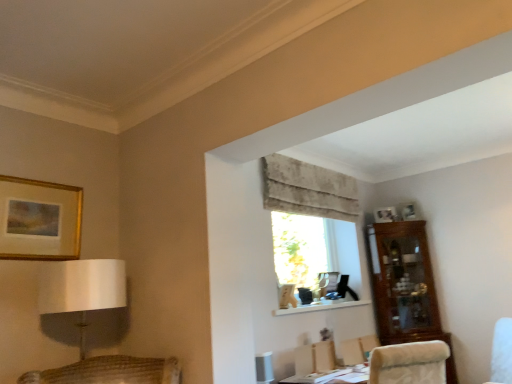
Question: Is gold/glossy picture frame at upper left, marked as the 1th picture frame in a left-to-right arrangement, closer to the viewer compared to beige textured curtain at upper center?

Choices:
 (A) yes
 (B) no

Answer: (A)

Question: Is gold/glossy picture frame at upper left, marked as the 1th picture frame in a left-to-right arrangement, oriented towards beige textured curtain at upper center?

Choices:
 (A) no
 (B) yes

Answer: (A)

Question: Is gold/glossy picture frame at upper left, which is the 3th picture frame from back to front, wider than beige textured curtain at upper center?

Choices:
 (A) no
 (B) yes

Answer: (A)

Question: From the image's perspective, would you say gold/glossy picture frame at upper left, which is the third picture frame from right to left, is shown under beige textured curtain at upper center?

Choices:
 (A) yes
 (B) no

Answer: (A)

Question: From the image's perspective, is gold/glossy picture frame at upper left, which is the third picture frame from right to left, located above beige textured curtain at upper center?

Choices:
 (A) no
 (B) yes

Answer: (A)

Question: Looking at the image, does white matte shelf at center seem bigger or smaller compared to white glossy picture frame at upper right, positioned as the third picture frame in front-to-back order?

Choices:
 (A) big
 (B) small

Answer: (A)

Question: Which is correct: white matte shelf at center is inside white glossy picture frame at upper right, arranged as the third picture frame when viewed from the left, or outside of it?

Choices:
 (A) inside
 (B) outside

Answer: (B)

Question: From the image's perspective, relative to white glossy picture frame at upper right, positioned as the third picture frame in front-to-back order, is white matte shelf at center above or below?

Choices:
 (A) above
 (B) below

Answer: (B)

Question: Considering the positions of point (307, 309) and point (399, 206), is point (307, 309) closer or farther from the camera than point (399, 206)?

Choices:
 (A) closer
 (B) farther

Answer: (A)

Question: Is point coord(316,220) closer or farther from the camera than point coord(51,195)?

Choices:
 (A) farther
 (B) closer

Answer: (A)

Question: Is translucent fabric window at center to the left or to the right of gold/glossy picture frame at upper left, marked as the 1th picture frame in a left-to-right arrangement, in the image?

Choices:
 (A) right
 (B) left

Answer: (A)

Question: From the image's perspective, is translucent fabric window at center positioned above or below gold/glossy picture frame at upper left, marked as the 1th picture frame in a left-to-right arrangement?

Choices:
 (A) above
 (B) below

Answer: (B)

Question: Is translucent fabric window at center bigger or smaller than gold/glossy picture frame at upper left, marked as the 1th picture frame in a left-to-right arrangement?

Choices:
 (A) small
 (B) big

Answer: (B)

Question: Considering their positions, is beige textured curtain at upper center located in front of or behind matte silver picture frame at upper right, marked as the 2th picture frame in a right-to-left arrangement?

Choices:
 (A) behind
 (B) front

Answer: (B)

Question: In terms of width, does beige textured curtain at upper center look wider or thinner when compared to matte silver picture frame at upper right, marked as the 2th picture frame in a right-to-left arrangement?

Choices:
 (A) thin
 (B) wide

Answer: (B)